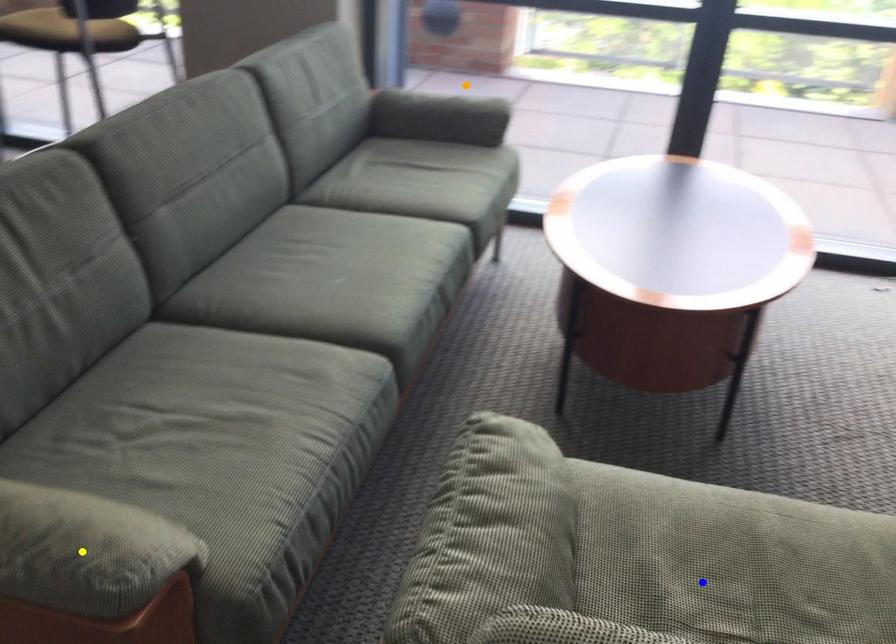
Order these from nearest to farthest:
yellow point
orange point
blue point

yellow point
blue point
orange point